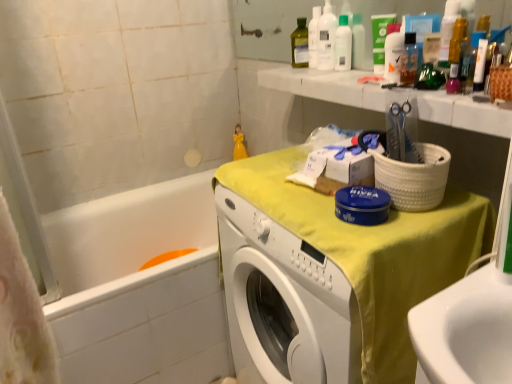
Question: Does yellow fabric-covered washer at center have a smaller size compared to white glossy bottle at upper center, the first cleaning product in the front-to-back sequence?

Choices:
 (A) yes
 (B) no

Answer: (B)

Question: Can you confirm if yellow fabric-covered washer at center is shorter than white glossy bottle at upper center, which ranks as the 2th cleaning product in back-to-front order?

Choices:
 (A) yes
 (B) no

Answer: (B)

Question: Is the position of yellow fabric-covered washer at center more distant than that of white glossy bottle at upper center, the first cleaning product in the front-to-back sequence?

Choices:
 (A) no
 (B) yes

Answer: (A)

Question: Is yellow fabric-covered washer at center bigger than white glossy bottle at upper center, which is the second cleaning product in left-to-right order?

Choices:
 (A) no
 (B) yes

Answer: (B)

Question: From a real-world perspective, does yellow fabric-covered washer at center stand above white glossy bottle at upper center, which is the second cleaning product in left-to-right order?

Choices:
 (A) no
 (B) yes

Answer: (A)

Question: Looking at their shapes, would you say clear plastic bottle at upper center is wider or thinner than white plastic bottle at upper center?

Choices:
 (A) wide
 (B) thin

Answer: (B)

Question: Considering the relative positions of clear plastic bottle at upper center and white plastic bottle at upper center in the image provided, is clear plastic bottle at upper center to the left or to the right of white plastic bottle at upper center?

Choices:
 (A) left
 (B) right

Answer: (B)

Question: Which is correct: clear plastic bottle at upper center is inside white plastic bottle at upper center, or outside of it?

Choices:
 (A) outside
 (B) inside

Answer: (A)

Question: Is clear plastic bottle at upper center taller or shorter than white plastic bottle at upper center?

Choices:
 (A) short
 (B) tall

Answer: (A)

Question: Based on their positions, is white plastic bottles at upper center, which ranks as the first cleaning product in left-to-right order, located to the left or right of white glossy bathtub at lower left?

Choices:
 (A) right
 (B) left

Answer: (A)

Question: In the image, is white plastic bottles at upper center, which ranks as the 1th cleaning product in back-to-front order, positioned in front of or behind white glossy bathtub at lower left?

Choices:
 (A) front
 (B) behind

Answer: (B)

Question: Choose the correct answer: Is white plastic bottles at upper center, the 2th cleaning product from the right, inside white glossy bathtub at lower left or outside it?

Choices:
 (A) inside
 (B) outside

Answer: (B)

Question: Is white plastic bottles at upper center, which ranks as the first cleaning product in left-to-right order, bigger or smaller than white glossy bathtub at lower left?

Choices:
 (A) small
 (B) big

Answer: (A)

Question: Is white glossy bottle at upper center, the 1th cleaning product positioned from the right, to the left or to the right of green matte tube at upper center in the image?

Choices:
 (A) left
 (B) right

Answer: (B)

Question: Is white glossy bottle at upper center, the 1th cleaning product positioned from the right, spatially inside green matte tube at upper center, or outside of it?

Choices:
 (A) inside
 (B) outside

Answer: (B)